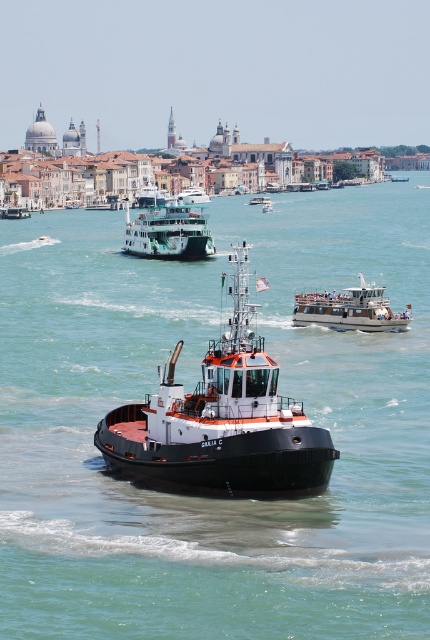
Question: Which object is closer to the camera taking this photo?

Choices:
 (A) white glossy ferry at center
 (B) white glossy boat at center

Answer: (B)

Question: Which object is positioned closest to the white glossy boat at center?

Choices:
 (A) clear blue water at center
 (B) white glossy ferry at center

Answer: (A)

Question: Is clear blue water at center closer to camera compared to green matte ferry at center?

Choices:
 (A) yes
 (B) no

Answer: (A)

Question: Among these objects, which one is farthest from the camera?

Choices:
 (A) black rubber tugboat at center
 (B) clear blue water at center
 (C) white glossy ferry at center

Answer: (C)

Question: In this image, where is green matte ferry at center located relative to white glossy ferry at center?

Choices:
 (A) left
 (B) right

Answer: (A)

Question: Can you confirm if green matte ferry at center is thinner than white glossy boat at center?

Choices:
 (A) yes
 (B) no

Answer: (B)